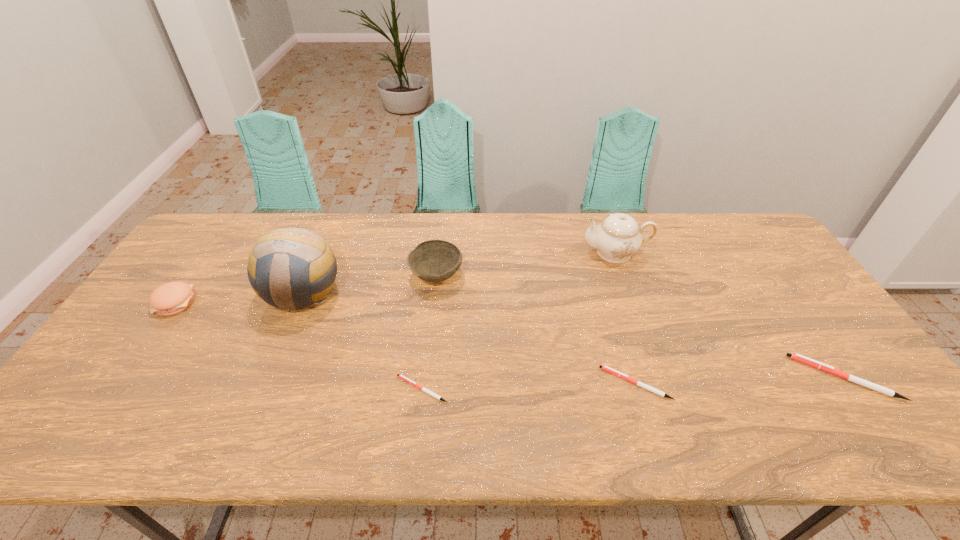
I want to click on the fourth shortest object, so click(171, 298).

Locate an element on the screen. This screenshot has height=540, width=960. the leftmost object is located at coordinates (171, 298).

You are a GUI agent. You are given a task and a screenshot of the screen. Output one action in this format:
    pyautogui.click(x=<x>, y=<y>)
    Task: Click on the vacant space located on the clicker of the shortest pen
    
    Given the screenshot: What is the action you would take?
    pyautogui.click(x=229, y=389)

At what (x,y) coordinates should I click in order to perform the action: click on vacant region located 0.400m on the clicker of the shortest pen. Please return your answer as a coordinate pair (x, y). Looking at the image, I should click on (229, 389).

Locate an element on the screen. The width and height of the screenshot is (960, 540). vacant space located 0.340m on the clicker of the shortest pen is located at coordinates (254, 389).

You are a GUI agent. You are given a task and a screenshot of the screen. Output one action in this format:
    pyautogui.click(x=<x>, y=<y>)
    Task: Click on the vacant space located on the clicker of the second shortest object
    Image resolution: width=960 pixels, height=540 pixels.
    Given the screenshot: What is the action you would take?
    pyautogui.click(x=463, y=383)

Locate an element on the screen. vacant space located 0.280m on the clicker of the second shortest object is located at coordinates (487, 383).

I want to click on vacant space located 0.250m on the clicker of the second shortest object, so click(499, 383).

Identify the location of vacant space located 0.270m on the clicker of the third shortest object. This screenshot has height=540, width=960. (688, 377).

Where is `vacant region located 0.090m on the clicker of the third shortest object`? This screenshot has height=540, width=960. vacant region located 0.090m on the clicker of the third shortest object is located at coordinates (x=761, y=377).